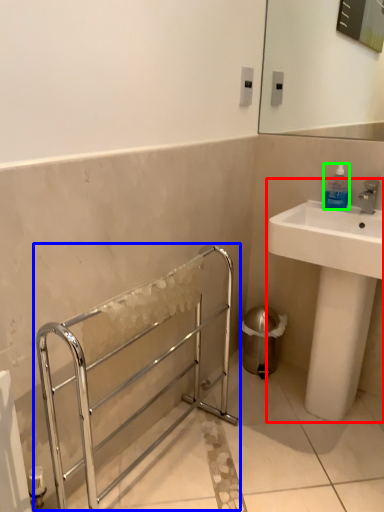
Question: Considering the real-world distances, which object is farthest from sink (highlighted by a red box)? balustrade (highlighted by a blue box) or bottle (highlighted by a green box)?

Choices:
 (A) balustrade
 (B) bottle

Answer: (A)